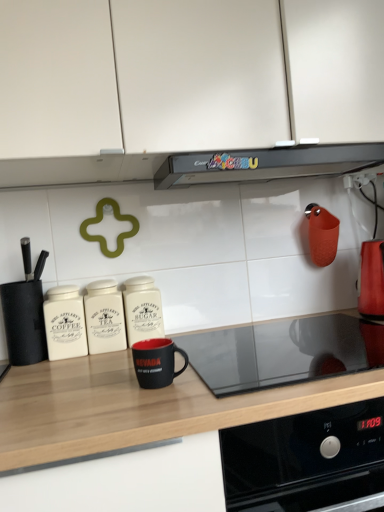
I want to click on vacant space to the left of black matte mug at center, placed as the 4th kitchen appliance when sorted from left to right, so click(76, 402).